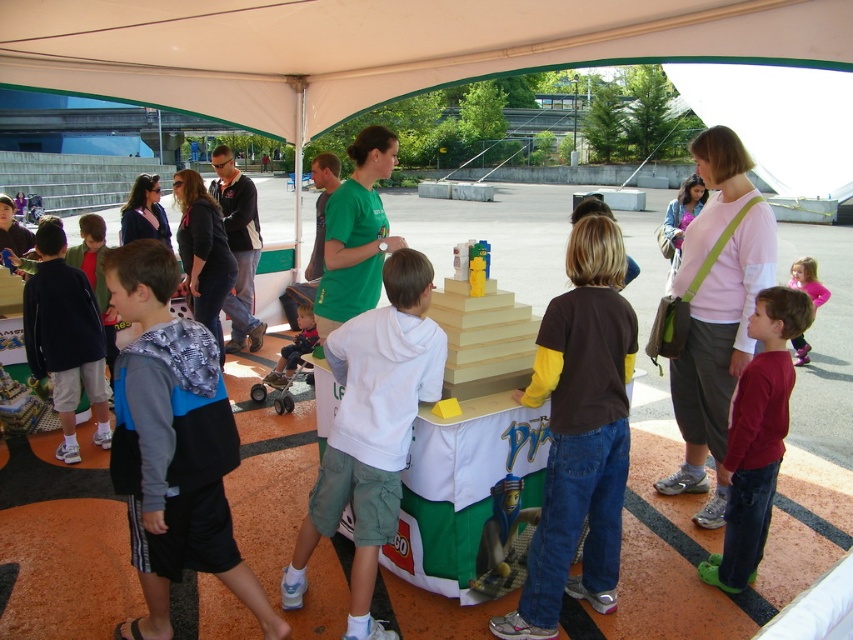
Can you confirm if pink fabric shirt at center is bigger than matte black hoodie at center?

Indeed, pink fabric shirt at center has a larger size compared to matte black hoodie at center.

Is pink fabric shirt at center shorter than matte black hoodie at center?

No.

This screenshot has height=640, width=853. Find the location of `pink fabric shirt at center`. pink fabric shirt at center is located at coordinates (717, 301).

Who is positioned more to the left, patterned fabric jacket at center or matte blue hoodie at center?

Positioned to the left is patterned fabric jacket at center.

Can you confirm if patterned fabric jacket at center is positioned above matte blue hoodie at center?

Yes.

Find the location of a particular element. patterned fabric jacket at center is located at coordinates (202, 252).

Is blue/grey fabric shirt at center smaller than transparent fabric canopy at upper center?

No, blue/grey fabric shirt at center is not smaller than transparent fabric canopy at upper center.

Does point (183, 477) lie in front of point (837, 140)?

Yes, point (183, 477) is closer to viewer.

Locate an element on the screen. Image resolution: width=853 pixels, height=640 pixels. blue/grey fabric shirt at center is located at coordinates (173, 445).